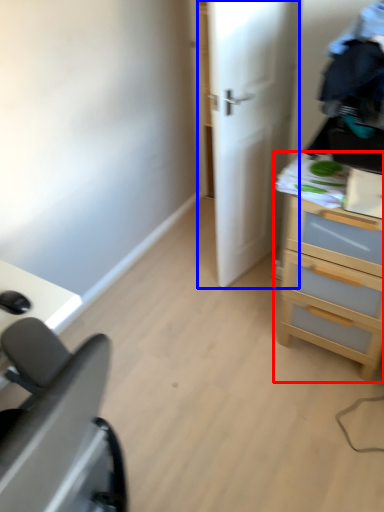
Question: Which point is closer to the camera, chest of drawers (highlighted by a red box) or door (highlighted by a blue box)?

Choices:
 (A) chest of drawers
 (B) door

Answer: (A)